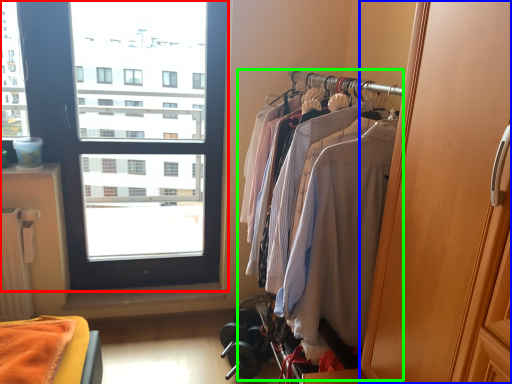
Question: Which object is the closest to the window (highlighted by a red box)? Choose among these: screen door (highlighted by a blue box) or closet (highlighted by a green box).

Choices:
 (A) screen door
 (B) closet

Answer: (B)